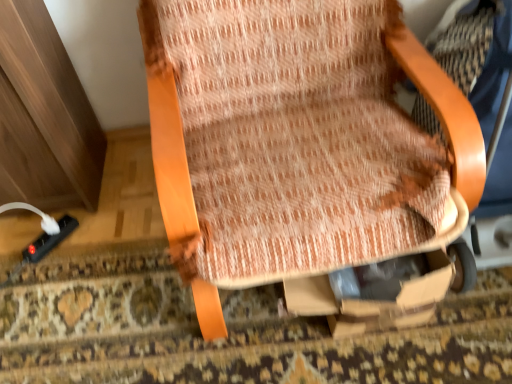
Question: From a real-world perspective, relative to textured fabric chair at center, is black plastic plug at lower left vertically above or below?

Choices:
 (A) above
 (B) below

Answer: (B)

Question: In terms of height, does black plastic plug at lower left look taller or shorter compared to textured fabric chair at center?

Choices:
 (A) tall
 (B) short

Answer: (B)

Question: Does point (55, 241) appear closer or farther from the camera than point (415, 283)?

Choices:
 (A) closer
 (B) farther

Answer: (B)

Question: Would you say textured fabric chair at center is to the left or to the right of black plastic plug at lower left in the picture?

Choices:
 (A) right
 (B) left

Answer: (A)

Question: Considering the positions of point coord(196,87) and point coord(53,243), is point coord(196,87) closer or farther from the camera than point coord(53,243)?

Choices:
 (A) closer
 (B) farther

Answer: (A)

Question: Based on their sizes in the image, would you say textured fabric chair at center is bigger or smaller than black plastic plug at lower left?

Choices:
 (A) small
 (B) big

Answer: (B)

Question: From the image's perspective, is textured fabric chair at center located above or below black plastic plug at lower left?

Choices:
 (A) above
 (B) below

Answer: (A)